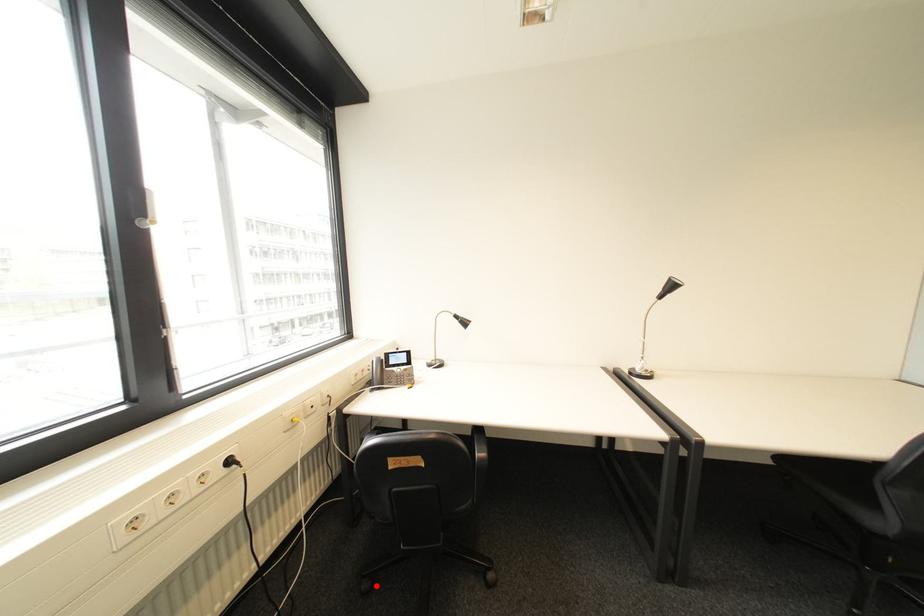
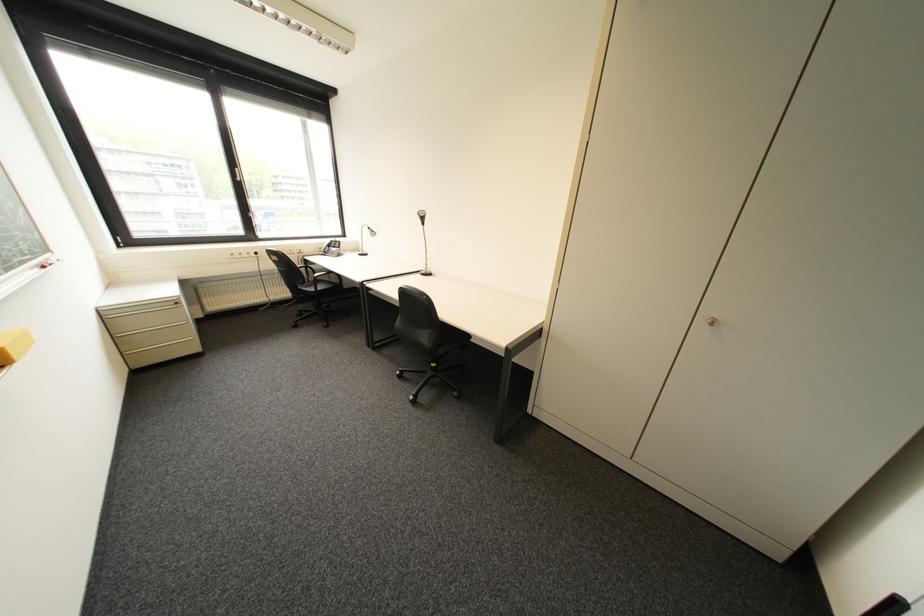
Question: I am providing you with two images of the same scene from different viewpoints. A red point is shown in image1. For the corresponding object point in image2, is it positioned nearer or farther from the camera?

Choices:
 (A) Nearer
 (B) Farther

Answer: (A)